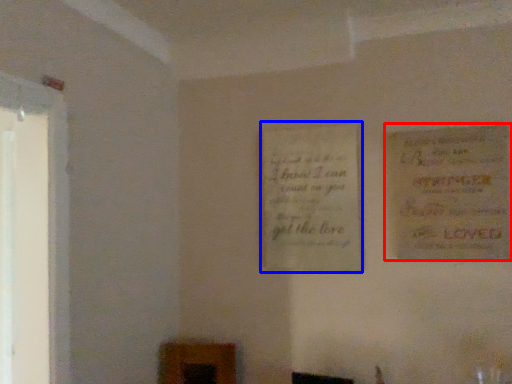
Question: Which of the following is the closest to the observer, poster (highlighted by a red box) or poster (highlighted by a blue box)?

Choices:
 (A) poster
 (B) poster

Answer: (A)